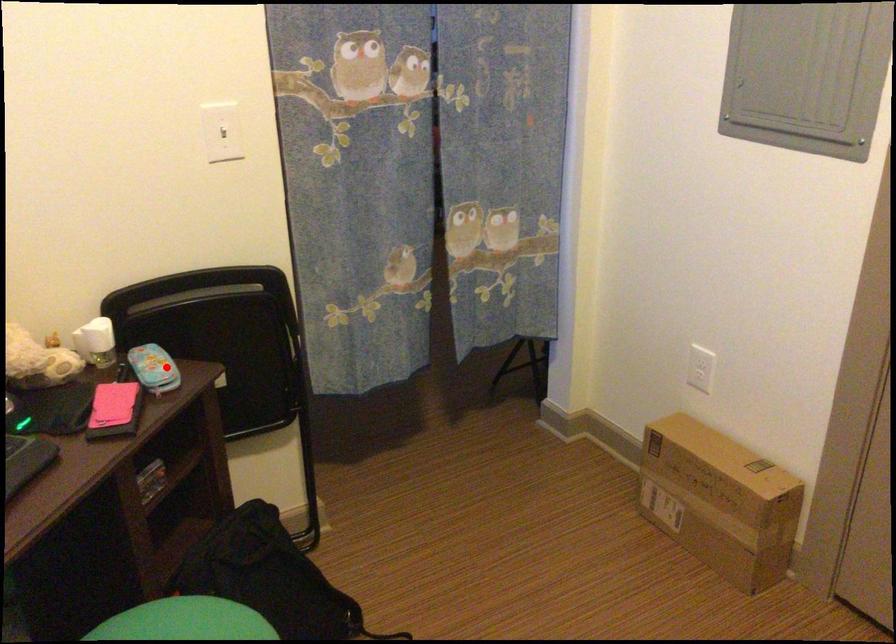
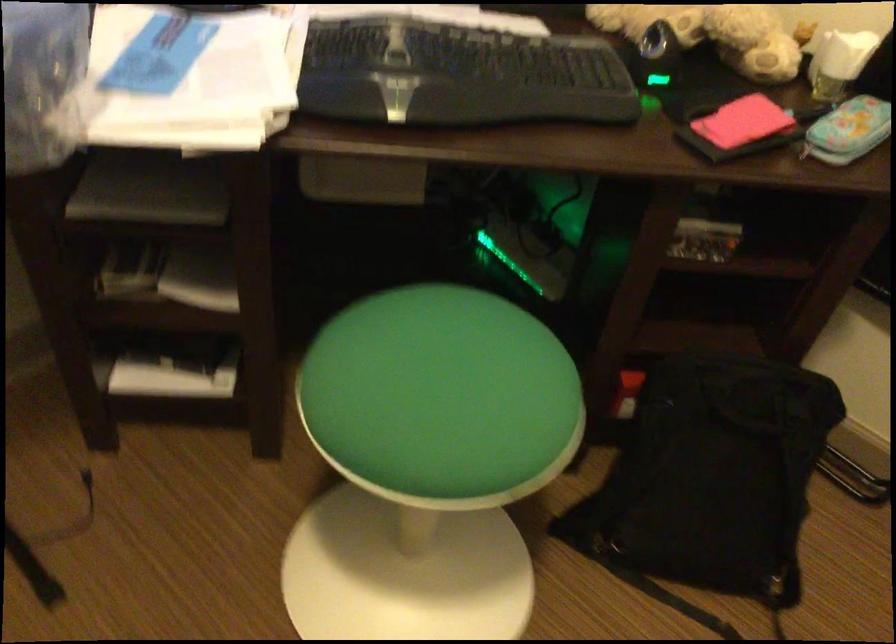
Locate, in the second image, the point that corresponds to the highlighted location in the first image.

(848, 129)